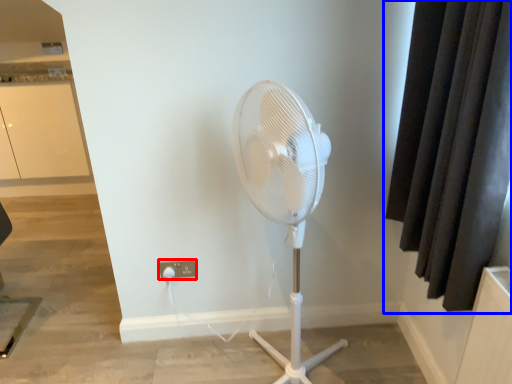
Question: Which object appears farthest to the camera in this image, electric outlet (highlighted by a red box) or curtain (highlighted by a blue box)?

Choices:
 (A) electric outlet
 (B) curtain

Answer: (A)